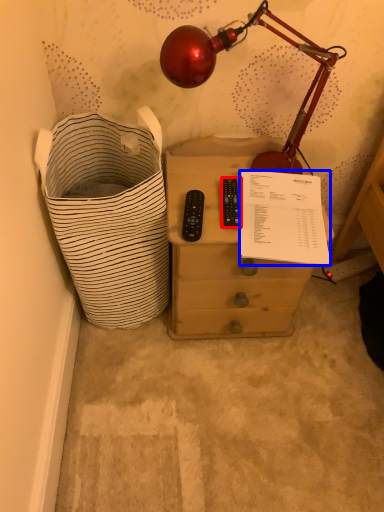
Question: Which object appears farthest to the camera in this image, control (highlighted by a red box) or writing (highlighted by a blue box)?

Choices:
 (A) control
 (B) writing

Answer: (A)